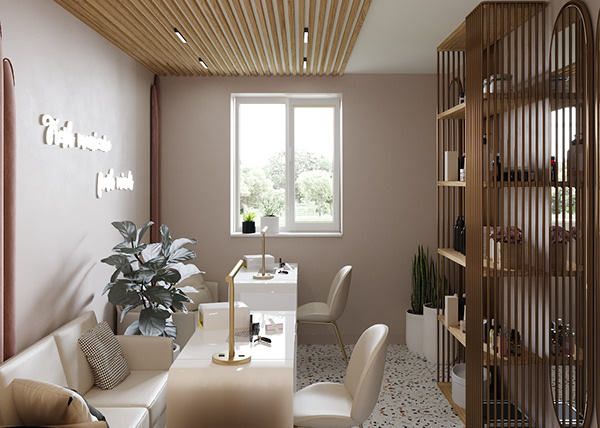
The height and width of the screenshot is (428, 600). I want to click on shelving unit, so click(468, 223).